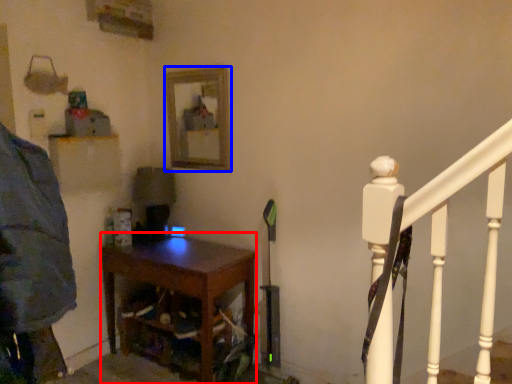
Question: Which object is closer to the camera taking this photo, nightstand (highlighted by a red box) or mirror (highlighted by a blue box)?

Choices:
 (A) nightstand
 (B) mirror

Answer: (A)